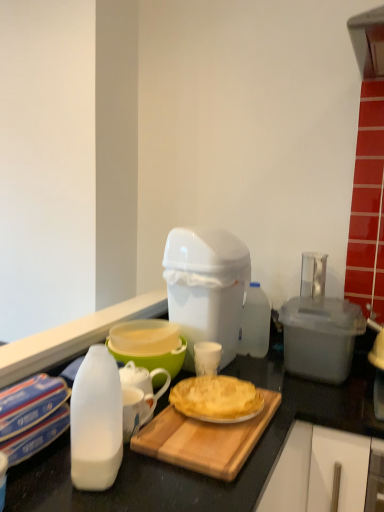
Identify the location of free location in front of golden flaky pie at center. The image size is (384, 512). (198, 441).